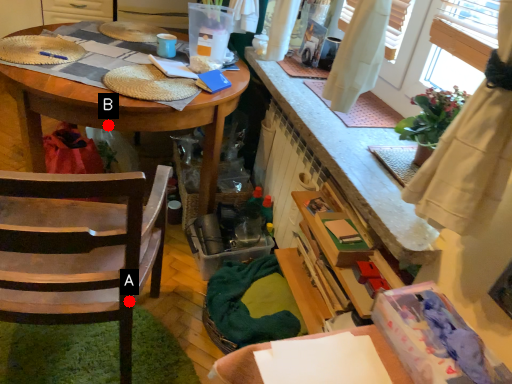
Question: Two points are circled on the image, labeled by A and B beside each circle. Which point appears farthest from the camera in this image?

Choices:
 (A) A is further
 (B) B is further

Answer: (B)